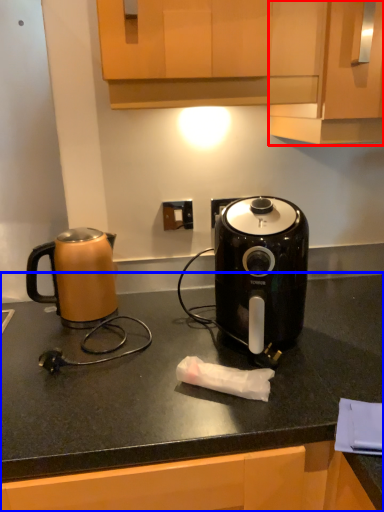
Question: Which point is further to the camera, cabinetry (highlighted by a red box) or countertop (highlighted by a blue box)?

Choices:
 (A) cabinetry
 (B) countertop

Answer: (A)